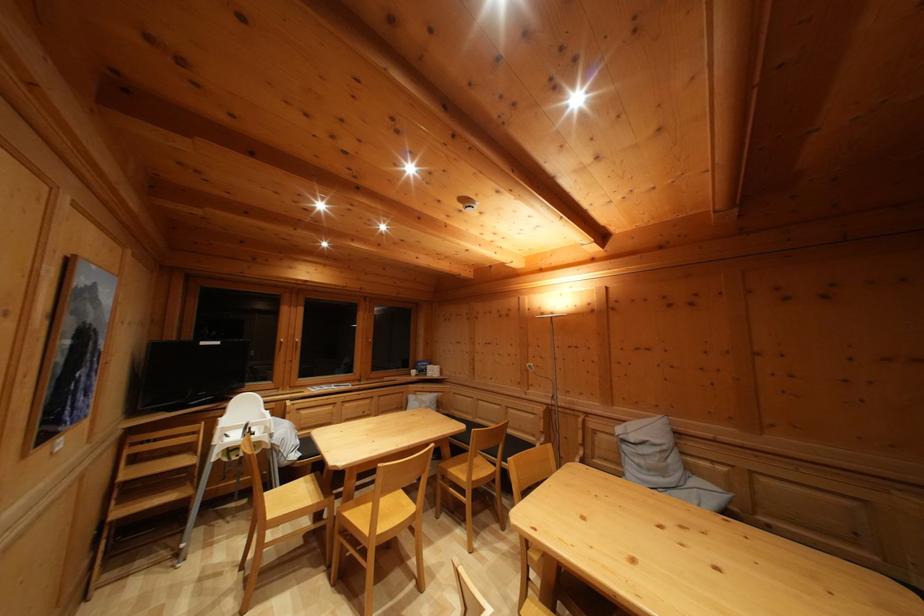
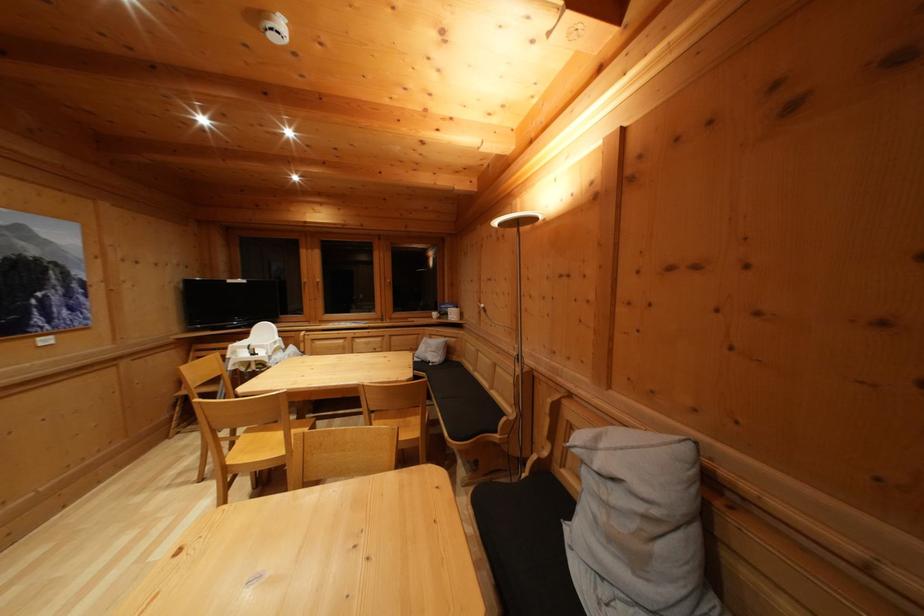
In the second image, find the point that corresponds to [426,369] in the first image.

(450, 310)